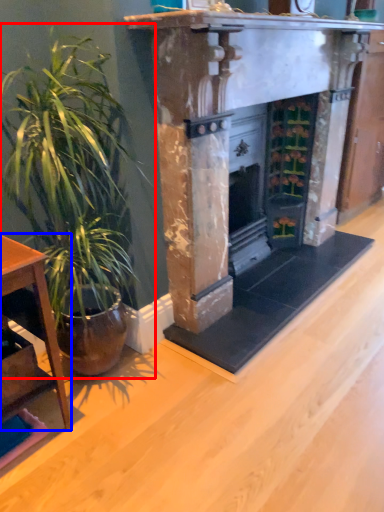
Question: Among these objects, which one is nearest to the camera, houseplant (highlighted by a red box) or table (highlighted by a blue box)?

Choices:
 (A) houseplant
 (B) table

Answer: (A)